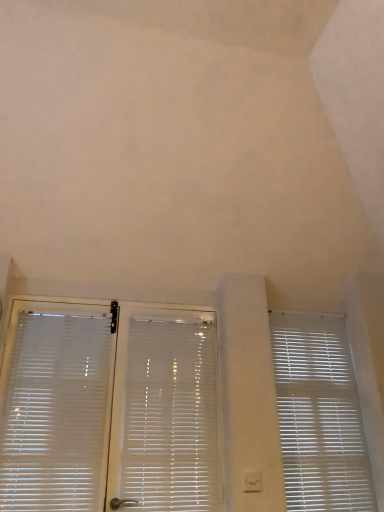
Question: From a real-world perspective, is white plastic blinds at center, which is the second window blind in right-to-left order, physically above white translucent blinds at left, placed as the 1th window blind when sorted from left to right?

Choices:
 (A) no
 (B) yes

Answer: (A)

Question: From the image's perspective, does white plastic blinds at center, which is the second window blind in right-to-left order, appear lower than white translucent blinds at left, placed as the 3th window blind when sorted from right to left?

Choices:
 (A) no
 (B) yes

Answer: (B)

Question: From the image's perspective, is white plastic blinds at center, which is the second window blind in right-to-left order, on top of white translucent blinds at left, placed as the 1th window blind when sorted from left to right?

Choices:
 (A) no
 (B) yes

Answer: (A)

Question: Can you confirm if white plastic blinds at center, which appears as the second window blind when viewed from the left, is smaller than white translucent blinds at left, placed as the 3th window blind when sorted from right to left?

Choices:
 (A) yes
 (B) no

Answer: (B)

Question: Is white plastic blinds at center, which appears as the second window blind when viewed from the left, facing towards white translucent blinds at left, placed as the 1th window blind when sorted from left to right?

Choices:
 (A) yes
 (B) no

Answer: (B)

Question: Can you confirm if white plastic blinds at center, which appears as the second window blind when viewed from the left, is shorter than white translucent blinds at left, placed as the 1th window blind when sorted from left to right?

Choices:
 (A) yes
 (B) no

Answer: (B)

Question: Is white translucent blinds at left, placed as the 3th window blind when sorted from right to left, looking in the opposite direction of white plastic window blind at right, the third window blind in the left-to-right sequence?

Choices:
 (A) yes
 (B) no

Answer: (B)

Question: Can you confirm if white translucent blinds at left, placed as the 3th window blind when sorted from right to left, is thinner than white plastic window blind at right, the third window blind in the left-to-right sequence?

Choices:
 (A) no
 (B) yes

Answer: (A)

Question: Is white translucent blinds at left, placed as the 3th window blind when sorted from right to left, beside white plastic window blind at right, the third window blind in the left-to-right sequence?

Choices:
 (A) no
 (B) yes

Answer: (A)

Question: Would you say white translucent blinds at left, placed as the 3th window blind when sorted from right to left, is a long distance from white plastic window blind at right, the third window blind in the left-to-right sequence?

Choices:
 (A) no
 (B) yes

Answer: (B)

Question: Is white translucent blinds at left, placed as the 3th window blind when sorted from right to left, smaller than white plastic window blind at right, the third window blind in the left-to-right sequence?

Choices:
 (A) yes
 (B) no

Answer: (A)

Question: Can we say white translucent blinds at left, placed as the 3th window blind when sorted from right to left, lies outside white plastic window blind at right, the third window blind in the left-to-right sequence?

Choices:
 (A) yes
 (B) no

Answer: (A)

Question: Considering the relative sizes of white plastic blinds at center, which appears as the second window blind when viewed from the left, and white plastic window blind at right, the third window blind in the left-to-right sequence, in the image provided, is white plastic blinds at center, which appears as the second window blind when viewed from the left, thinner than white plastic window blind at right, the third window blind in the left-to-right sequence,?

Choices:
 (A) no
 (B) yes

Answer: (A)